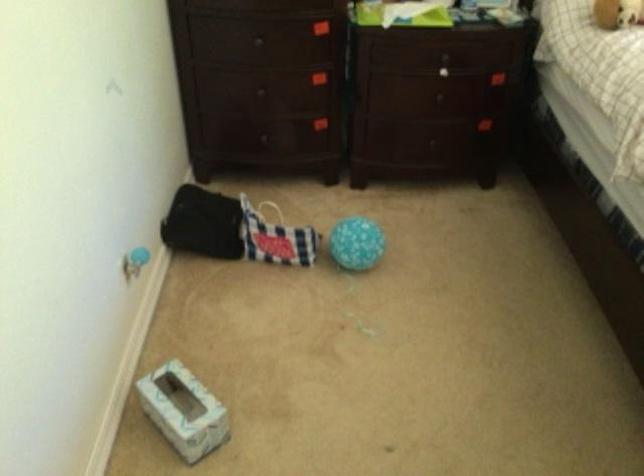
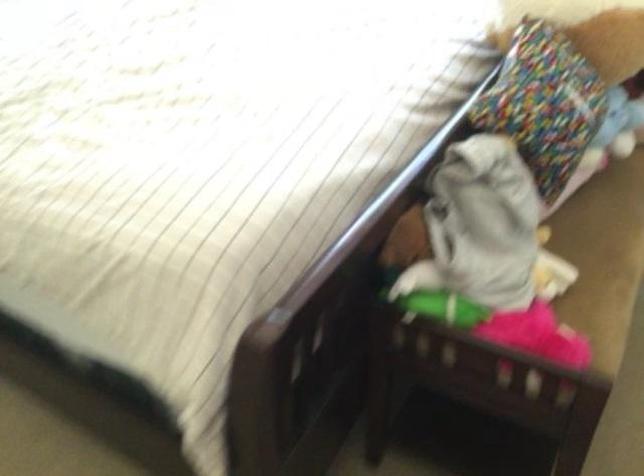
Question: The first image is from the beginning of the video and the second image is from the end. How did the camera likely rotate when shooting the video?

Choices:
 (A) Left
 (B) Right
 (C) Up
 (D) Down

Answer: (B)